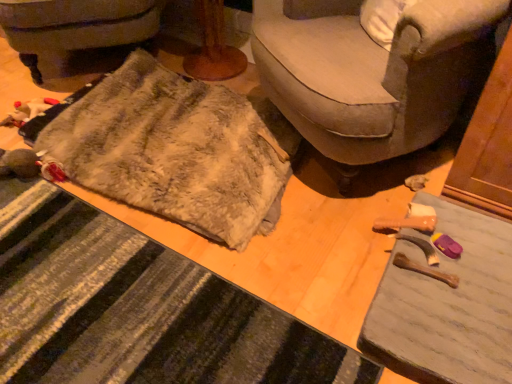
Question: Is point (160, 279) closer or farther from the camera than point (184, 132)?

Choices:
 (A) closer
 (B) farther

Answer: (A)

Question: Would you say fuzzy fabric doormat at lower left is inside or outside fuzzy beige blanket at lower left?

Choices:
 (A) inside
 (B) outside

Answer: (B)

Question: Which is nearer to the fuzzy fabric blanket at lower left?

Choices:
 (A) soft beige fabric couch at center
 (B) fuzzy fabric doormat at lower left
 (C) wooden table at lower right
 (D) fuzzy beige blanket at lower left

Answer: (D)

Question: Which object is positioned farthest from the fuzzy fabric blanket at lower left?

Choices:
 (A) soft beige fabric couch at center
 (B) fuzzy fabric doormat at lower left
 (C) wooden table at lower right
 (D) fuzzy beige blanket at lower left

Answer: (C)